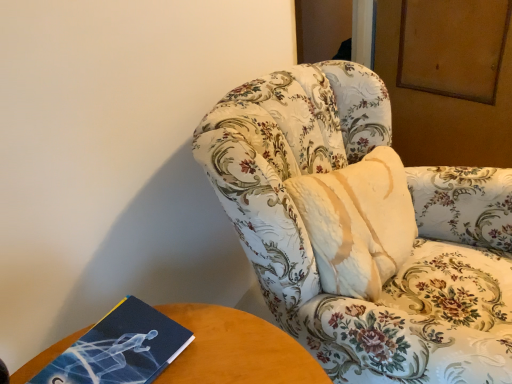
Question: Is floral-patterned fabric chair at center bigger than blue matte book at lower left?

Choices:
 (A) no
 (B) yes

Answer: (B)

Question: From a real-world perspective, is floral-patterned fabric chair at center located beneath blue matte book at lower left?

Choices:
 (A) no
 (B) yes

Answer: (B)

Question: Is floral-patterned fabric chair at center oriented away from blue matte book at lower left?

Choices:
 (A) yes
 (B) no

Answer: (B)

Question: Does floral-patterned fabric chair at center have a lesser width compared to blue matte book at lower left?

Choices:
 (A) yes
 (B) no

Answer: (B)

Question: Is the surface of floral-patterned fabric chair at center in direct contact with blue matte book at lower left?

Choices:
 (A) yes
 (B) no

Answer: (B)

Question: Is floral-patterned fabric chair at center behind blue matte book at lower left?

Choices:
 (A) no
 (B) yes

Answer: (A)

Question: Is blue matte book at lower left thinner than floral-patterned fabric chair at center?

Choices:
 (A) yes
 (B) no

Answer: (A)

Question: Is blue matte book at lower left bigger than floral-patterned fabric chair at center?

Choices:
 (A) yes
 (B) no

Answer: (B)

Question: From a real-world perspective, is blue matte book at lower left below floral-patterned fabric chair at center?

Choices:
 (A) yes
 (B) no

Answer: (B)

Question: Considering the relative positions of blue matte book at lower left and floral-patterned fabric chair at center in the image provided, is blue matte book at lower left to the right of floral-patterned fabric chair at center from the viewer's perspective?

Choices:
 (A) yes
 (B) no

Answer: (B)

Question: Is blue matte book at lower left in contact with floral-patterned fabric chair at center?

Choices:
 (A) no
 (B) yes

Answer: (A)

Question: From a real-world perspective, is blue matte book at lower left located higher than floral-patterned fabric chair at center?

Choices:
 (A) no
 (B) yes

Answer: (B)

Question: Looking at their shapes, would you say blue matte book at lower left is wider or thinner than floral-patterned fabric chair at center?

Choices:
 (A) thin
 (B) wide

Answer: (A)